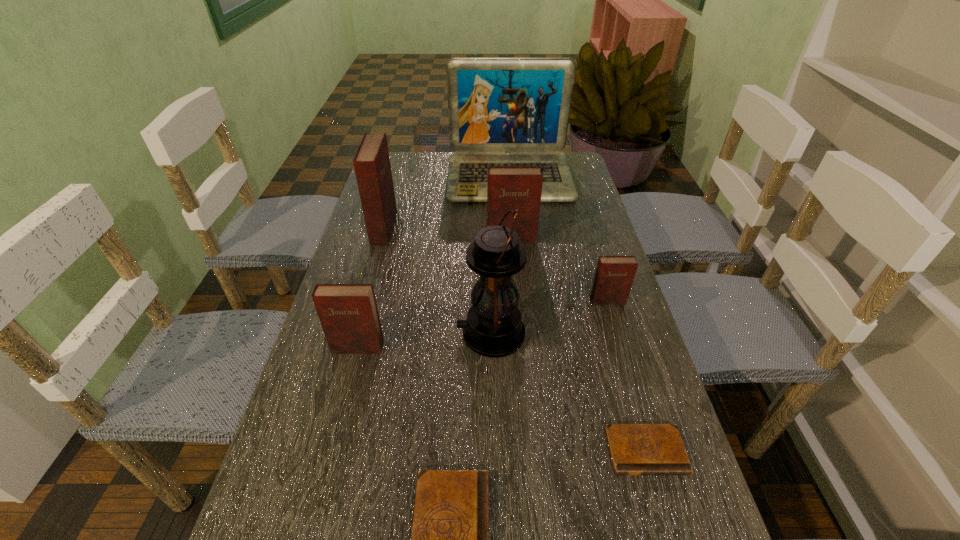
Identify the location of the farthest object. (502, 111).

I want to click on lantern, so click(494, 328).

The width and height of the screenshot is (960, 540). Find the location of `the third tallest object`. the third tallest object is located at coordinates point(372,167).

Identify the location of the biggest reddish-brown diary. The image size is (960, 540). (372, 167).

Locate an element on the screen. The height and width of the screenshot is (540, 960). the fourth diary from left to right is located at coordinates (509, 187).

I want to click on the second biggest reddish-brown diary, so click(x=509, y=187).

At what (x,y) coordinates should I click in order to perform the action: click on the third nearest diary. Please return your answer as a coordinate pair (x, y). The image size is (960, 540). Looking at the image, I should click on (348, 313).

Identify the location of the fourth shortest object. (348, 313).

At what (x,y) coordinates should I click in order to perform the action: click on the smallest reddish-brown diary. Please return your answer as a coordinate pair (x, y). The height and width of the screenshot is (540, 960). Looking at the image, I should click on (614, 275).

At what (x,y) coordinates should I click in order to perform the action: click on the fourth tallest diary. Please return your answer as a coordinate pair (x, y). Looking at the image, I should click on (614, 275).